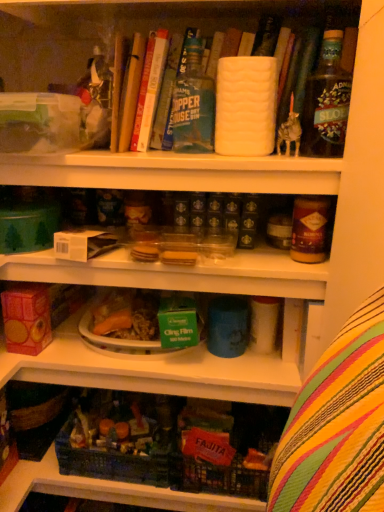
Question: Is hardcover book at upper center, which is the 3th book from right to left, at the back of hardcover book at upper center, which is the second book from left to right?

Choices:
 (A) yes
 (B) no

Answer: (A)

Question: Does hardcover book at upper center, the second book from the right, have a greater width compared to hardcover book at upper center, arranged as the first book when viewed from the left?

Choices:
 (A) no
 (B) yes

Answer: (A)

Question: Is hardcover book at upper center, the second book from the right, to the left of hardcover book at upper center, arranged as the first book when viewed from the left, from the viewer's perspective?

Choices:
 (A) no
 (B) yes

Answer: (A)

Question: Does hardcover book at upper center, which is the second book from left to right, lie behind hardcover book at upper center, arranged as the first book when viewed from the left?

Choices:
 (A) no
 (B) yes

Answer: (B)

Question: Is hardcover book at upper center, the second book from the right, beside hardcover book at upper center, arranged as the first book when viewed from the left?

Choices:
 (A) no
 (B) yes

Answer: (B)

Question: From a real-world perspective, does hardcover book at upper center, the second book from the right, sit lower than hardcover book at upper center, which is the 3th book from right to left?

Choices:
 (A) no
 (B) yes

Answer: (A)

Question: Does hardcover book at upper center, the second book from the right, turn towards brown glass jar at upper right?

Choices:
 (A) no
 (B) yes

Answer: (A)

Question: Is brown glass jar at upper right a part of hardcover book at upper center, the second book from the right?

Choices:
 (A) yes
 (B) no

Answer: (B)

Question: From a real-world perspective, is hardcover book at upper center, which is the second book from left to right, on top of brown glass jar at upper right?

Choices:
 (A) no
 (B) yes

Answer: (B)

Question: Is hardcover book at upper center, the second book from the right, not within brown glass jar at upper right?

Choices:
 (A) no
 (B) yes

Answer: (B)

Question: Would you consider hardcover book at upper center, the second book from the right, to be distant from brown glass jar at upper right?

Choices:
 (A) yes
 (B) no

Answer: (B)

Question: Considering the relative sizes of hardcover book at upper center, the second book from the right, and brown glass jar at upper right in the image provided, is hardcover book at upper center, the second book from the right, wider than brown glass jar at upper right?

Choices:
 (A) no
 (B) yes

Answer: (B)

Question: Is hardcover book at upper center, arranged as the first book when viewed from the left, oriented towards green glass bottle at upper right, which is the 1th bottle from right to left?

Choices:
 (A) no
 (B) yes

Answer: (A)